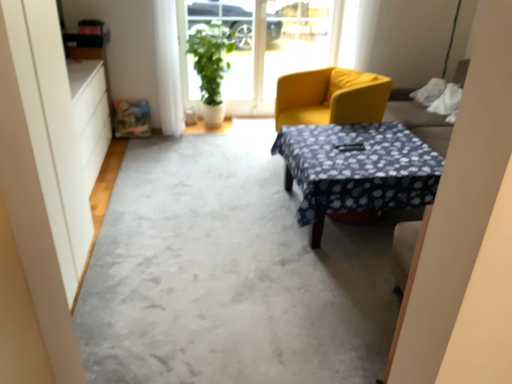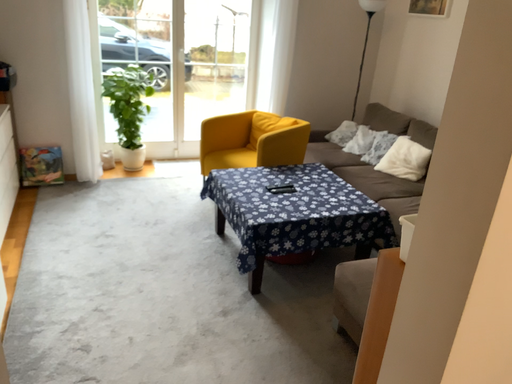
Question: Which way did the camera rotate in the video?

Choices:
 (A) rotated left
 (B) rotated right

Answer: (B)